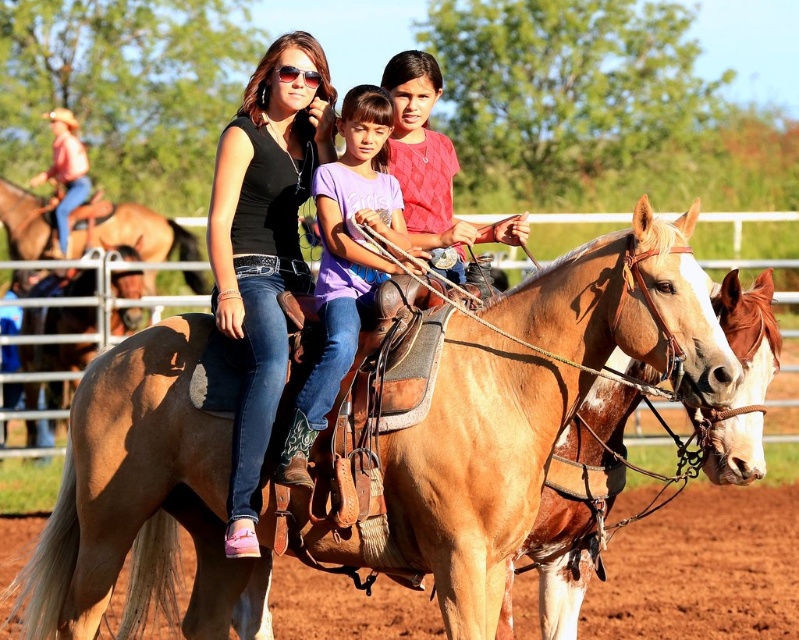
Who is lower down, light brown leather saddle at center or matte black shirt at center?

light brown leather saddle at center

Which is in front, point (561, 262) or point (293, 221)?

Point (561, 262) is in front.

The image size is (799, 640). What do you see at coordinates (134, 497) in the screenshot?
I see `light brown leather saddle at center` at bounding box center [134, 497].

The width and height of the screenshot is (799, 640). I want to click on light brown leather saddle at center, so click(134, 497).

Is light brown leather saddle at center above purple denim jeans at center?

No, light brown leather saddle at center is not above purple denim jeans at center.

Consider the image. Between light brown leather saddle at center and purple denim jeans at center, which one has more height?

Standing taller between the two is purple denim jeans at center.

Identify the location of light brown leather saddle at center. (134, 497).

Where is `light brown leather saddle at center`? The image size is (799, 640). light brown leather saddle at center is located at coordinates (134, 497).

Can you confirm if brown leather horse at center is positioned to the left of brown leather saddle at upper left?

Incorrect, brown leather horse at center is not on the left side of brown leather saddle at upper left.

From the picture: Is brown leather horse at center shorter than brown leather saddle at upper left?

In fact, brown leather horse at center may be taller than brown leather saddle at upper left.

Does point (617, 381) lie behind point (120, 221)?

That is False.

Identify the location of brown leather horse at center. The image size is (799, 640). (574, 512).